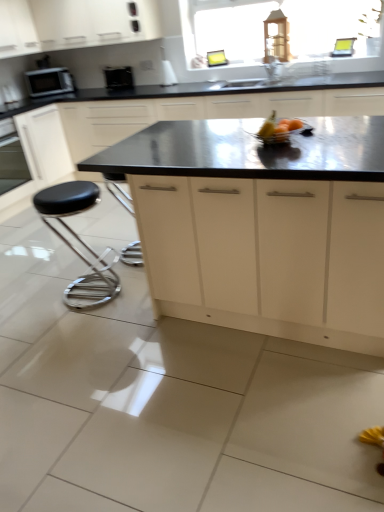
Measure the distance between point (x=71, y=80) and camera.

Point (x=71, y=80) is 4.81 meters away from camera.

Image resolution: width=384 pixels, height=512 pixels. What do you see at coordinates (49, 81) in the screenshot? I see `satin black microwave at upper left` at bounding box center [49, 81].

What is the approximate width of satin white cabinet at center, acting as the 4th cabinetry starting from the top?

4.87 feet.

This screenshot has height=512, width=384. What do you see at coordinates (280, 130) in the screenshot?
I see `metallic silver bowl at center` at bounding box center [280, 130].

At what (x,y) coordinates should I click in order to perform the action: click on black glossy microwave at upper left. Please return your answer as a coordinate pair (x, y). The image size is (384, 512). Looking at the image, I should click on (118, 78).

You are a GUI agent. You are given a task and a screenshot of the screen. Output one action in this format:
    pyautogui.click(x=<x>, y=<y>)
    Task: Click on the white matte cabinet at upper left, which is counted as the 3th cabinetry, starting from the bottom
    The height and width of the screenshot is (512, 384).
    Given the screenshot: What is the action you would take?
    pyautogui.click(x=17, y=29)

In terms of width, does black polished countertop at center look wider or thinner when compared to satin white cabinet at center, acting as the 4th cabinetry starting from the top?

Considering their sizes, black polished countertop at center looks slimmer than satin white cabinet at center, acting as the 4th cabinetry starting from the top.

The image size is (384, 512). Find the location of `countertop that appears on the left of satin white cabinet at center, acting as the 4th cabinetry starting from the top`. countertop that appears on the left of satin white cabinet at center, acting as the 4th cabinetry starting from the top is located at coordinates (168, 118).

Is black polished countertop at center not within satin white cabinet at center, acting as the 4th cabinetry starting from the top?

black polished countertop at center is positioned outside satin white cabinet at center, acting as the 4th cabinetry starting from the top.

Would you say black polished countertop at center is to the left or to the right of satin white cabinet at center, acting as the 4th cabinetry starting from the top, in the picture?

black polished countertop at center is positioned on satin white cabinet at center, acting as the 4th cabinetry starting from the top,'s left side.

Which object is positioned more to the left, white matte cabinet at upper center, which is the 1th cabinetry from top to bottom, or black glossy microwave at upper left?

From the viewer's perspective, white matte cabinet at upper center, which is the 1th cabinetry from top to bottom, appears more on the left side.

Does point (20, 26) come closer to viewer compared to point (130, 72)?

Yes, point (20, 26) is closer to viewer.

This screenshot has width=384, height=512. What are the coordinates of `kitchen appliance below the white matte cabinet at upper center, the 4th cabinetry in the bottom-to-top sequence (from the image's perspective)` in the screenshot? It's located at (118, 78).

Is metallic silver bowl at center completely or partially outside of black glossy microwave at upper left?

Yes, metallic silver bowl at center is outside of black glossy microwave at upper left.

Can you confirm if metallic silver bowl at center is wider than black glossy microwave at upper left?

Yes, metallic silver bowl at center is wider than black glossy microwave at upper left.

From the image's perspective, is metallic silver bowl at center positioned above or below black glossy microwave at upper left?

metallic silver bowl at center is below black glossy microwave at upper left.

The width and height of the screenshot is (384, 512). What are the coordinates of `kitchen appliance behind the metallic silver bowl at center` in the screenshot? It's located at (118, 78).

Considering the relative sizes of black glossy microwave at upper left and white matte cabinet at upper center, the 2th cabinetry when ordered from bottom to top, in the image provided, is black glossy microwave at upper left wider than white matte cabinet at upper center, the 2th cabinetry when ordered from bottom to top,?

In fact, black glossy microwave at upper left might be narrower than white matte cabinet at upper center, the 2th cabinetry when ordered from bottom to top.

Is black glossy microwave at upper left aimed at white matte cabinet at upper center, the 2th cabinetry when ordered from bottom to top?

No, black glossy microwave at upper left is not oriented towards white matte cabinet at upper center, the 2th cabinetry when ordered from bottom to top.

From the image's perspective, which one is positioned higher, black glossy microwave at upper left or white matte cabinet at upper center, the 2th cabinetry when ordered from bottom to top?

black glossy microwave at upper left appears higher in the image.

Do you think black glossy microwave at upper left is within white matte cabinet at upper center, the 2th cabinetry when ordered from bottom to top, or outside of it?

black glossy microwave at upper left is not enclosed by white matte cabinet at upper center, the 2th cabinetry when ordered from bottom to top.

Which object is further away from the camera, white matte cabinet at upper left, acting as the second cabinetry starting from the top, or black polished countertop at center?

white matte cabinet at upper left, acting as the second cabinetry starting from the top, is more distant.

How many degrees apart are the facing directions of white matte cabinet at upper left, which is counted as the 3th cabinetry, starting from the bottom, and black polished countertop at center?

90.1 degrees separate the facing orientations of white matte cabinet at upper left, which is counted as the 3th cabinetry, starting from the bottom, and black polished countertop at center.

Is there a large distance between white matte cabinet at upper left, acting as the second cabinetry starting from the top, and black polished countertop at center?

Yes, white matte cabinet at upper left, acting as the second cabinetry starting from the top, is far from black polished countertop at center.

Which is more to the left, white matte cabinet at upper left, which is counted as the 3th cabinetry, starting from the bottom, or black leather stool at lower left?

white matte cabinet at upper left, which is counted as the 3th cabinetry, starting from the bottom, is more to the left.

From the image's perspective, is white matte cabinet at upper left, which is counted as the 3th cabinetry, starting from the bottom, beneath black leather stool at lower left?

No.

How far apart are white matte cabinet at upper left, acting as the second cabinetry starting from the top, and black leather stool at lower left?

white matte cabinet at upper left, acting as the second cabinetry starting from the top, is 7.52 feet from black leather stool at lower left.

Is white matte cabinet at upper left, which is counted as the 3th cabinetry, starting from the bottom, facing towards black leather stool at lower left?

No, white matte cabinet at upper left, which is counted as the 3th cabinetry, starting from the bottom, is not oriented towards black leather stool at lower left.

From the image's perspective, is metallic silver bowl at center located above black leather stool at lower left?

Yes, from the image's perspective, metallic silver bowl at center is above black leather stool at lower left.

Is metallic silver bowl at center positioned far away from black leather stool at lower left?

Yes, metallic silver bowl at center and black leather stool at lower left are quite far apart.

Based on the photo, which is less distant, [269,125] or [112,274]?

Point [269,125] appears to be closer to the viewer than point [112,274].

Find the location of a particular element. Image resolution: width=384 pixels, height=512 pixels. cabinetry located in front of the black polished countertop at center is located at coordinates (262, 228).

The width and height of the screenshot is (384, 512). Find the location of `kitchen appliance behind the white matte cabinet at upper center, which is the 1th cabinetry from top to bottom`. kitchen appliance behind the white matte cabinet at upper center, which is the 1th cabinetry from top to bottom is located at coordinates (118, 78).

Based on their spatial positions, is metallic silver bowl at center or white matte cabinet at upper center, the 2th cabinetry when ordered from bottom to top, further from white matte cabinet at upper left, which is counted as the 3th cabinetry, starting from the bottom?

metallic silver bowl at center is positioned further to the anchor white matte cabinet at upper left, which is counted as the 3th cabinetry, starting from the bottom.

When comparing their distances from black leather stool at lower left, does black glossy microwave at upper left or satin white cabinet at center, placed as the 1th cabinetry when sorted from bottom to top, seem closer?

satin white cabinet at center, placed as the 1th cabinetry when sorted from bottom to top, is positioned closer to the anchor black leather stool at lower left.

Considering their positions, is satin black microwave at upper left positioned closer to satin white cabinet at center, acting as the 4th cabinetry starting from the top, than metallic silver bowl at center?

metallic silver bowl at center is closer to satin white cabinet at center, acting as the 4th cabinetry starting from the top.

When comparing their distances from satin black microwave at upper left, does white matte cabinet at upper left, which is counted as the 3th cabinetry, starting from the bottom, or black glossy microwave at upper left seem further?

Based on the image, black glossy microwave at upper left appears to be further to satin black microwave at upper left.

Which object lies nearer to the anchor point white matte cabinet at upper center, arranged as the 3th cabinetry when viewed from the top, satin black microwave at upper left or white matte cabinet at upper center, the 4th cabinetry in the bottom-to-top sequence?

Among the two, white matte cabinet at upper center, the 4th cabinetry in the bottom-to-top sequence, is located nearer to white matte cabinet at upper center, arranged as the 3th cabinetry when viewed from the top.

Based on their spatial positions, is black leather stool at lower left or satin white cabinet at center, acting as the 4th cabinetry starting from the top, further from black glossy microwave at upper left?

satin white cabinet at center, acting as the 4th cabinetry starting from the top, is positioned further to the anchor black glossy microwave at upper left.

Looking at the image, which one is located further to black glossy microwave at upper left, white matte cabinet at upper left, acting as the second cabinetry starting from the top, or satin white cabinet at center, acting as the 4th cabinetry starting from the top?

satin white cabinet at center, acting as the 4th cabinetry starting from the top, is further to black glossy microwave at upper left.

From the image, which object appears to be nearer to satin black microwave at upper left, white matte cabinet at upper center, which is the 1th cabinetry from top to bottom, or black leather stool at lower left?

Among the two, white matte cabinet at upper center, which is the 1th cabinetry from top to bottom, is located nearer to satin black microwave at upper left.

This screenshot has height=512, width=384. I want to click on kitchen appliance between black polished countertop at center and satin black microwave at upper left along the z-axis, so click(x=118, y=78).

Where is `stool located between satin white cabinet at center, placed as the 1th cabinetry when sorted from bottom to top, and satin black microwave at upper left in the depth direction`? The image size is (384, 512). stool located between satin white cabinet at center, placed as the 1th cabinetry when sorted from bottom to top, and satin black microwave at upper left in the depth direction is located at coordinates (79, 241).

At what (x,y) coordinates should I click in order to perform the action: click on countertop between black glossy microwave at upper left and white matte cabinet at upper center, arranged as the 3th cabinetry when viewed from the top, from left to right. Please return your answer as a coordinate pair (x, y). Looking at the image, I should click on (168, 118).

Where is `stool between metallic silver bowl at center and black polished countertop at center along the z-axis`? stool between metallic silver bowl at center and black polished countertop at center along the z-axis is located at coordinates (79, 241).